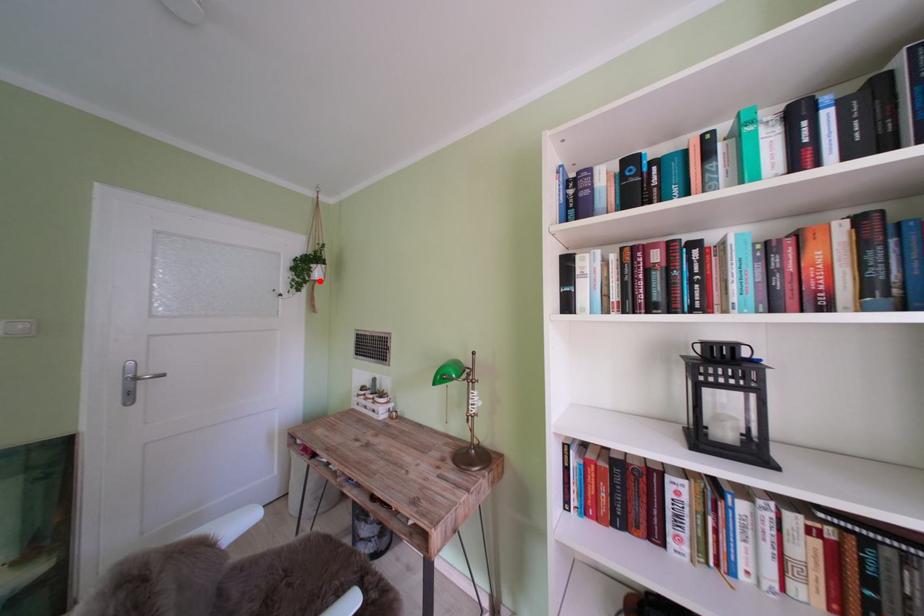
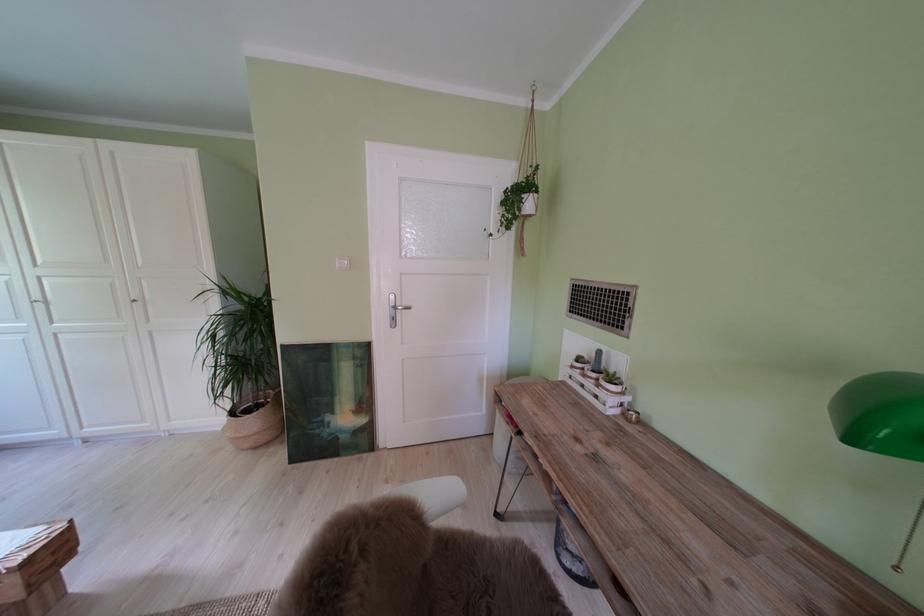
In the second image, find the point that corresponds to the highlighted location in the first image.

(530, 215)